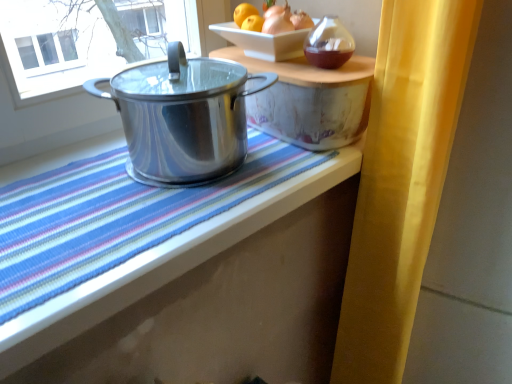
Question: Considering the relative positions of shiny metallic pot at right, the first table from the right, and shiny metallic pot at left in the image provided, is shiny metallic pot at right, the first table from the right, in front of shiny metallic pot at left?

Choices:
 (A) no
 (B) yes

Answer: (A)

Question: Is shiny metallic pot at right, the first table from the right, far from shiny metallic pot at left?

Choices:
 (A) yes
 (B) no

Answer: (B)

Question: Is shiny metallic pot at right, acting as the second table starting from the left, facing away from shiny metallic pot at left?

Choices:
 (A) no
 (B) yes

Answer: (A)

Question: Is shiny metallic pot at right, acting as the second table starting from the left, taller than shiny metallic pot at left?

Choices:
 (A) no
 (B) yes

Answer: (A)

Question: Considering the relative sizes of shiny metallic pot at right, acting as the second table starting from the left, and shiny metallic pot at left in the image provided, is shiny metallic pot at right, acting as the second table starting from the left, shorter than shiny metallic pot at left?

Choices:
 (A) yes
 (B) no

Answer: (A)

Question: From a real-world perspective, is shiny metallic pot at center, which ranks as the first table in left-to-right order, positioned above or below yellow fabric curtain at right?

Choices:
 (A) below
 (B) above

Answer: (B)

Question: In terms of width, does shiny metallic pot at center, marked as the second table in a right-to-left arrangement, look wider or thinner when compared to yellow fabric curtain at right?

Choices:
 (A) wide
 (B) thin

Answer: (B)

Question: Is shiny metallic pot at center, marked as the second table in a right-to-left arrangement, bigger or smaller than yellow fabric curtain at right?

Choices:
 (A) big
 (B) small

Answer: (B)

Question: From the image's perspective, is shiny metallic pot at center, which ranks as the first table in left-to-right order, positioned above or below yellow fabric curtain at right?

Choices:
 (A) above
 (B) below

Answer: (A)

Question: Considering their positions, is shiny metallic pot at center, marked as the second table in a right-to-left arrangement, located in front of or behind shiny metallic pot at left?

Choices:
 (A) front
 (B) behind

Answer: (A)

Question: Is shiny metallic pot at center, marked as the second table in a right-to-left arrangement, inside or outside of shiny metallic pot at left?

Choices:
 (A) inside
 (B) outside

Answer: (B)

Question: Is shiny metallic pot at center, marked as the second table in a right-to-left arrangement, bigger or smaller than shiny metallic pot at left?

Choices:
 (A) big
 (B) small

Answer: (A)

Question: Is shiny metallic pot at center, which ranks as the first table in left-to-right order, to the left or to the right of shiny metallic pot at left in the image?

Choices:
 (A) left
 (B) right

Answer: (A)

Question: From their relative heights in the image, would you say shiny metallic pot at left is taller or shorter than yellow fabric curtain at right?

Choices:
 (A) short
 (B) tall

Answer: (A)

Question: Based on their sizes in the image, would you say shiny metallic pot at left is bigger or smaller than yellow fabric curtain at right?

Choices:
 (A) small
 (B) big

Answer: (A)